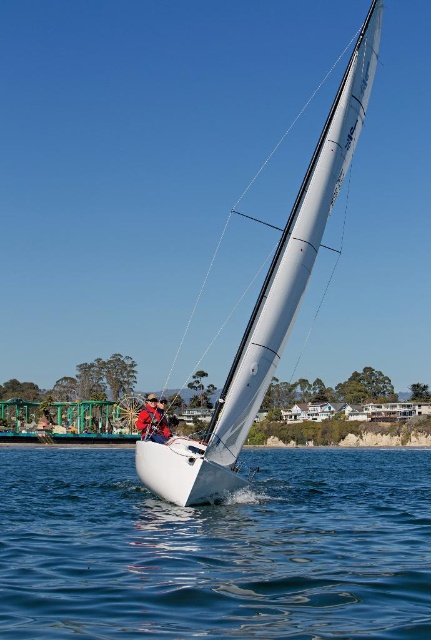
Question: Is clear blue water at center below white glossy sailboat at center?

Choices:
 (A) no
 (B) yes

Answer: (B)

Question: Can you confirm if clear blue water at center is positioned to the left of white glossy sailboat at center?

Choices:
 (A) no
 (B) yes

Answer: (B)

Question: Is clear blue water at center above white glossy sailboat at center?

Choices:
 (A) yes
 (B) no

Answer: (B)